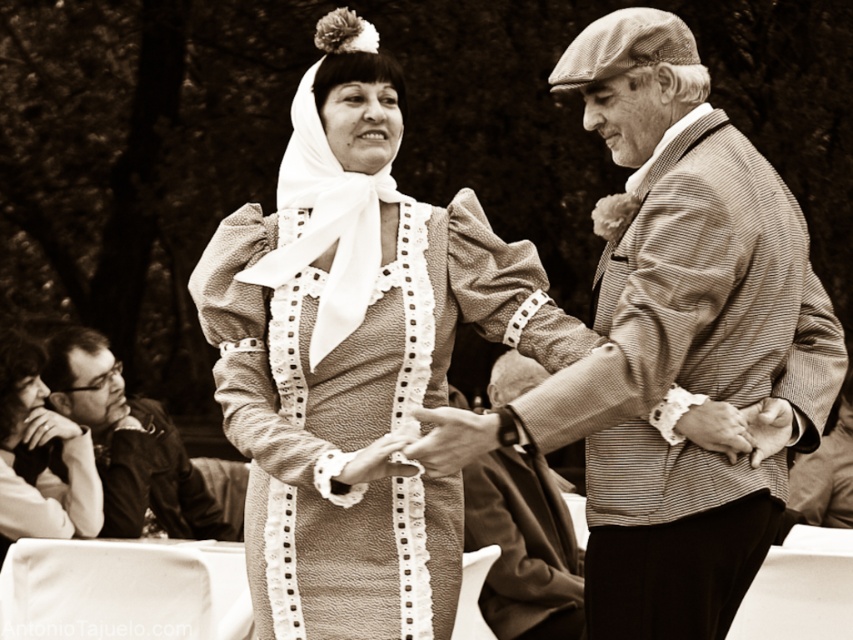
Which is in front, point (659, 189) or point (250, 339)?

Positioned in front is point (659, 189).

Is point (723, 186) positioned behind point (457, 531)?

That is False.

Where is `striped woolen jacket at center`? striped woolen jacket at center is located at coordinates (682, 340).

Between point (389, 540) and point (103, 429), which one is positioned behind?

Point (103, 429)

Is point (436, 582) positioned behind point (189, 531)?

No, it is in front of (189, 531).

Which is behind, point (456, 224) or point (202, 484)?

The point (202, 484) is more distant.

The height and width of the screenshot is (640, 853). I want to click on textured beige dress at center, so click(360, 412).

Can you confirm if striped woolen jacket at center is wider than matte black jacket at lower left?

Yes, striped woolen jacket at center is wider than matte black jacket at lower left.

Describe the element at coordinates (682, 340) in the screenshot. I see `striped woolen jacket at center` at that location.

At what (x,y) coordinates should I click in order to perform the action: click on striped woolen jacket at center. Please return your answer as a coordinate pair (x, y). Image resolution: width=853 pixels, height=640 pixels. Looking at the image, I should click on (682, 340).